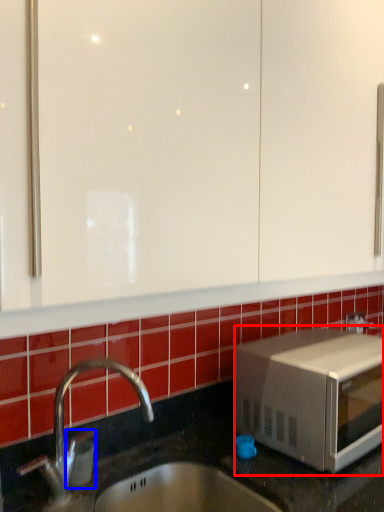
Question: Which object appears farthest to the camera in this image, microwave oven (highlighted by a red box) or soap dispenser (highlighted by a blue box)?

Choices:
 (A) microwave oven
 (B) soap dispenser

Answer: (A)